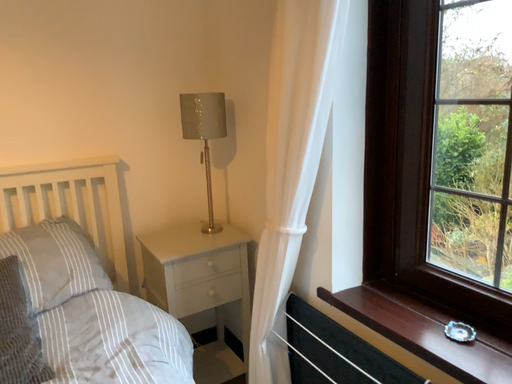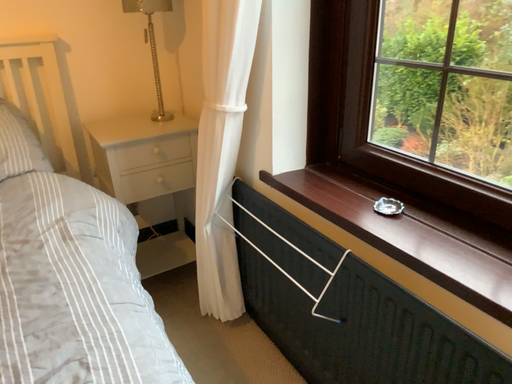
Question: Which way did the camera rotate in the video?

Choices:
 (A) rotated upward
 (B) rotated downward

Answer: (B)